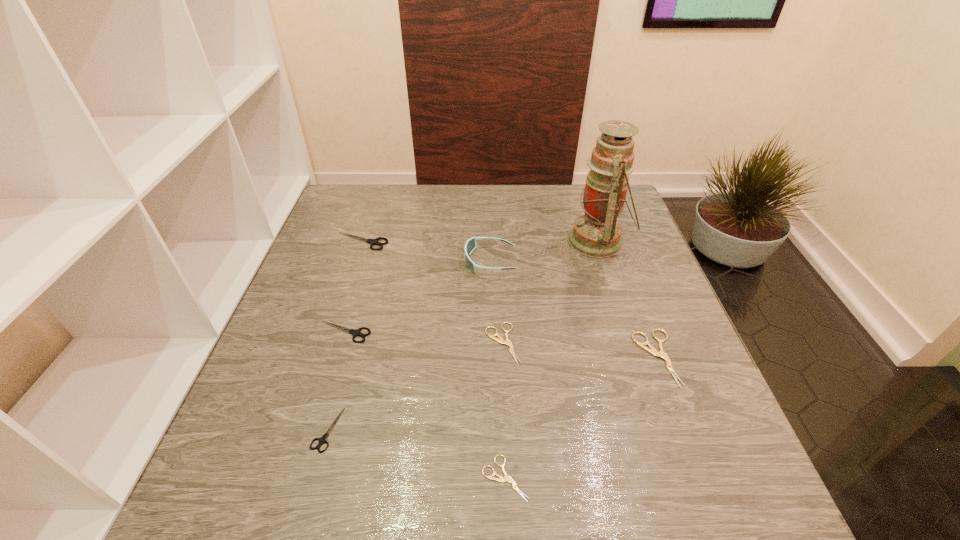
Locate an element on the screen. Image resolution: width=960 pixels, height=540 pixels. free spot at the left edge of the desktop is located at coordinates (310, 273).

This screenshot has height=540, width=960. I want to click on vacant space at the right edge, so click(728, 447).

The image size is (960, 540). In order to click on vacant area at the far left corner of the desktop in this screenshot , I will do `click(389, 186)`.

Find the location of a particular element. empty location between the smallest black shears and the second biggest beige shears is located at coordinates (415, 387).

Locate an element on the screen. vacant area between the second biggest black shears and the smallest black shears is located at coordinates (336, 381).

The image size is (960, 540). I want to click on free point between the seventh farthest object and the biggest black shears, so click(345, 335).

Locate an element on the screen. The image size is (960, 540). blank region between the shortest shears and the biggest black shears is located at coordinates tap(434, 360).

Identify the location of empty space that is in between the tallest object and the tallest shears. (480, 241).

At what (x,y) coordinates should I click in order to perform the action: click on vacant area that lies between the nearest beige shears and the tallest object. Please return your answer as a coordinate pair (x, y). The image size is (960, 540). Looking at the image, I should click on (551, 360).

Locate an element on the screen. vacant area that lies between the second biggest beige shears and the second tallest object is located at coordinates (496, 302).